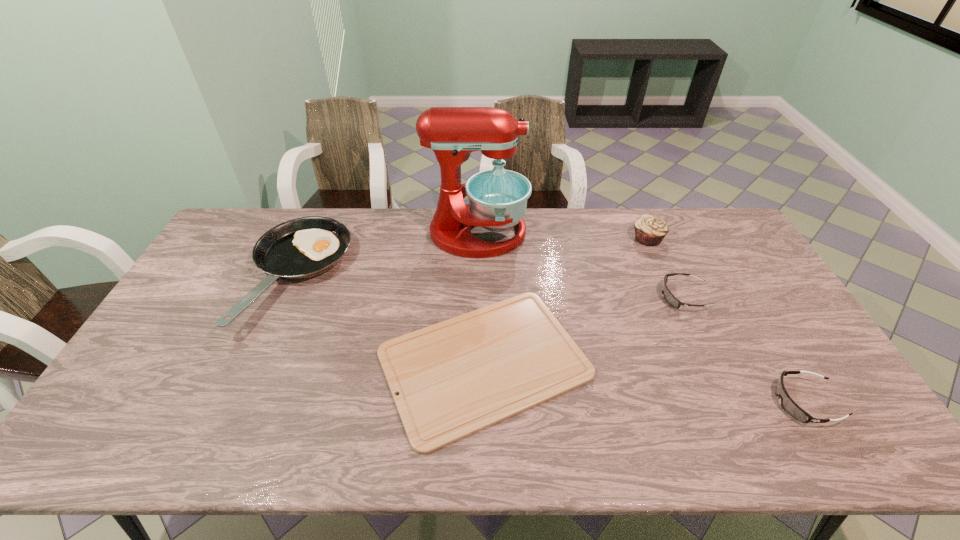
What are the coordinates of `free region located 0.240m on the right of the fourth shortest object` in the screenshot? It's located at (420, 276).

Locate an element on the screen. This screenshot has height=540, width=960. vacant space located 0.360m on the lenses of the farther goggles is located at coordinates (544, 296).

Locate an element on the screen. This screenshot has width=960, height=540. free region located 0.090m on the lenses of the farther goggles is located at coordinates click(632, 296).

Image resolution: width=960 pixels, height=540 pixels. What are the coordinates of `free region located 0.050m on the lenses of the farther goggles` in the screenshot? It's located at (644, 296).

Where is `vacant area situated on the front and sides of the nearer goggles`? The width and height of the screenshot is (960, 540). vacant area situated on the front and sides of the nearer goggles is located at coordinates (743, 402).

Identify the location of vacant area situated 0.100m on the front and sides of the nearer goggles. The height and width of the screenshot is (540, 960). (735, 402).

Find the location of a particular element. vacant space located 0.330m on the front and sides of the nearer goggles is located at coordinates (643, 402).

Locate an element on the screen. The image size is (960, 540). vacant area situated 0.350m on the right of the shortest object is located at coordinates (722, 362).

The width and height of the screenshot is (960, 540). What are the coordinates of `mixer that is at the far edge` in the screenshot? It's located at (498, 198).

Where is `muffin present at the far edge`? Image resolution: width=960 pixels, height=540 pixels. muffin present at the far edge is located at coordinates (650, 230).